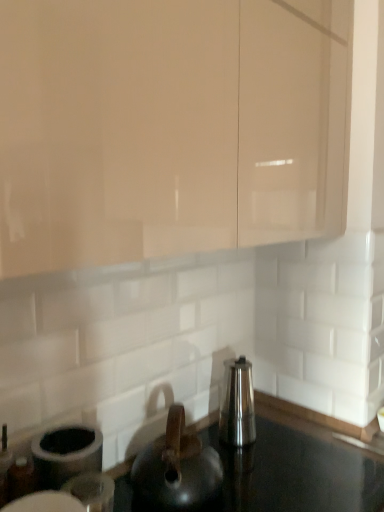
I want to click on free point to the right of satin silver kettle at center, so click(x=297, y=446).